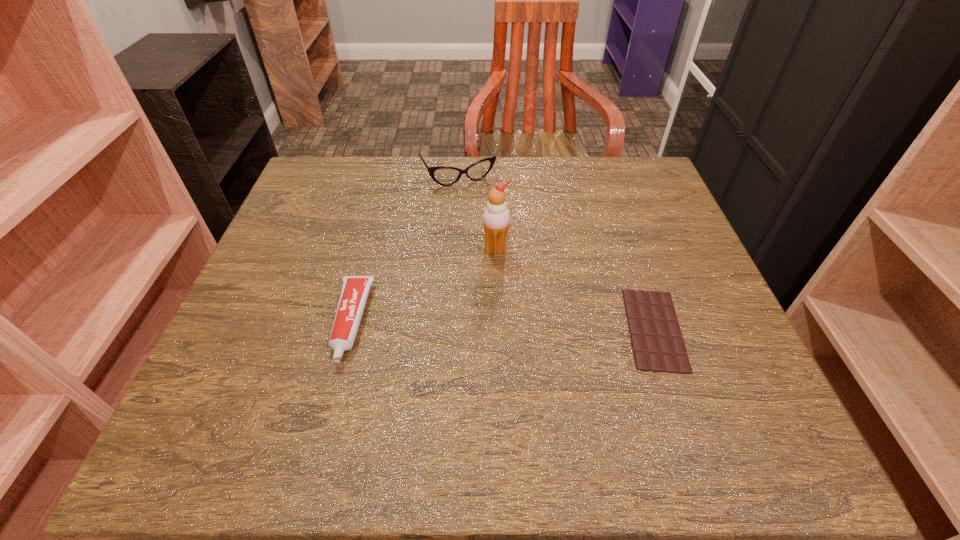
The width and height of the screenshot is (960, 540). In order to click on free spot on the desktop that is between the toothpaste and the chocolate bar and is positioned at the front with a straw on the icecream in this screenshot , I will do `click(531, 326)`.

This screenshot has width=960, height=540. What are the coordinates of `vacant space on the desktop that is between the leftmost object and the shortest object and is positioned on the front-facing side of the second tallest object` in the screenshot? It's located at (539, 326).